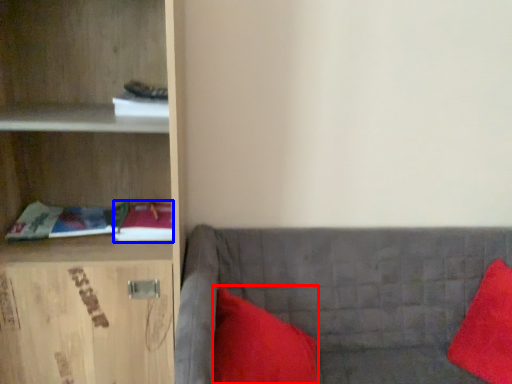
Question: Which of the following is the farthest to the observer, pillow (highlighted by a red box) or book (highlighted by a blue box)?

Choices:
 (A) pillow
 (B) book

Answer: (B)